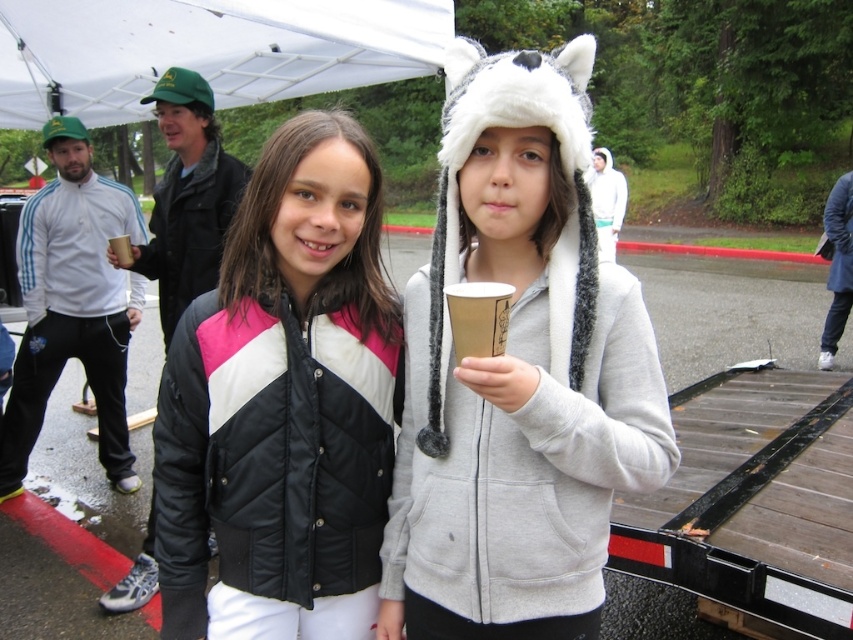
Question: Is brown paper cup at center to the right of brown paper cup at left from the viewer's perspective?

Choices:
 (A) yes
 (B) no

Answer: (A)

Question: Observing the image, what is the correct spatial positioning of white fabric canopy at upper center in reference to brown paper cup at center?

Choices:
 (A) left
 (B) right

Answer: (A)

Question: Which of these objects is positioned farthest from the brown paper cup at center?

Choices:
 (A) white fabric canopy at upper center
 (B) brown paper cup at left
 (C) black quilted jacket at center
 (D) gray fleece hoodie at center

Answer: (A)

Question: Which of these objects is positioned closest to the brown paper cup at center?

Choices:
 (A) gray fleece hoodie at center
 (B) black quilted jacket at center
 (C) white fabric canopy at upper center
 (D) brown paper cup at left

Answer: (A)

Question: Can you confirm if brown paper cup at center is positioned to the left of brown paper cup at left?

Choices:
 (A) yes
 (B) no

Answer: (B)

Question: Which point is farther to the camera?

Choices:
 (A) (291, 54)
 (B) (479, 308)

Answer: (A)